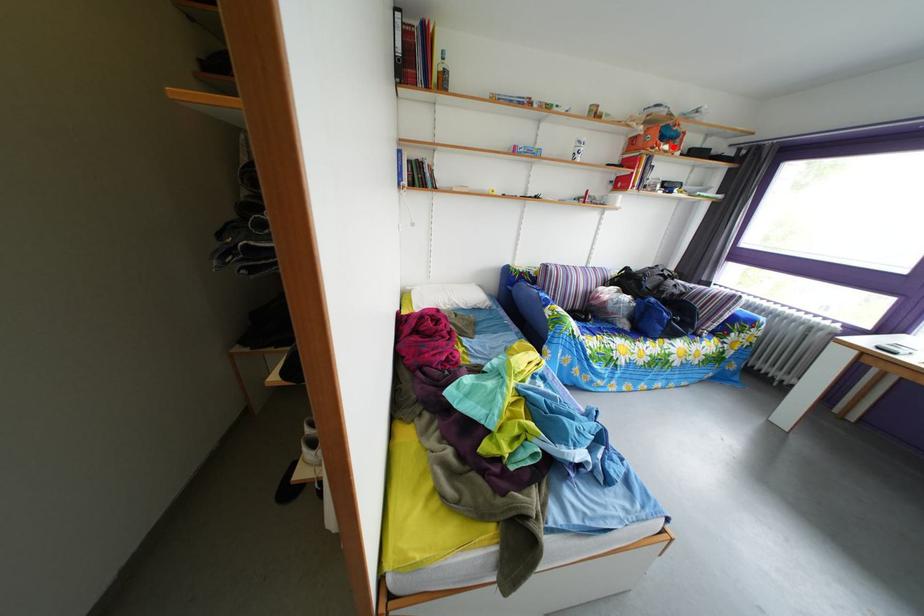
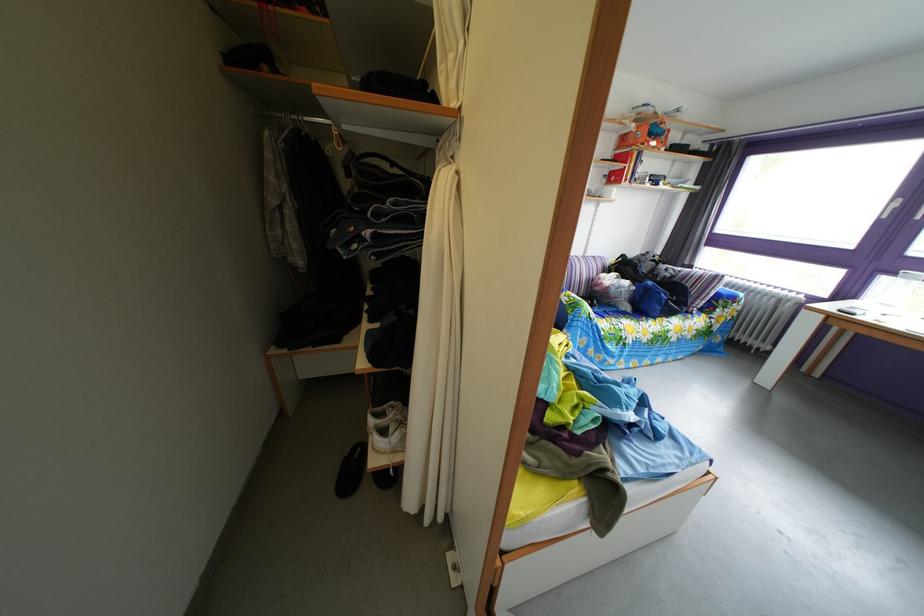
The point at the highlighted location is marked in the first image. Where is the corresponding point in the second image?

(661, 144)